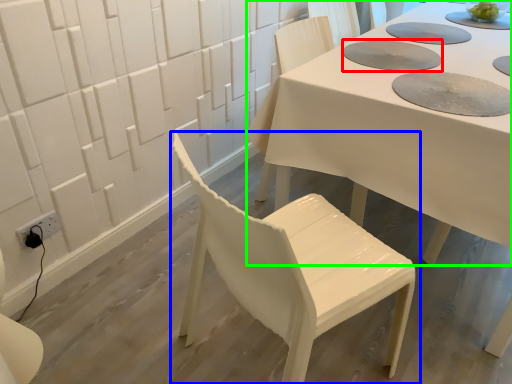
Question: Which is nearer to the paper plate (highlighted by a red box)? chair (highlighted by a blue box) or table (highlighted by a green box).

Choices:
 (A) chair
 (B) table

Answer: (B)